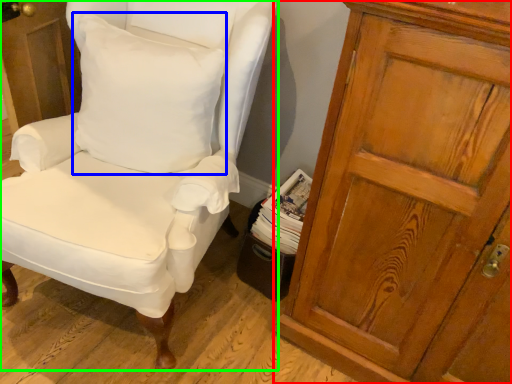
Question: Considering the real-world distances, which object is closest to cupboard (highlighted by a red box)? pillow (highlighted by a blue box) or chair (highlighted by a green box).

Choices:
 (A) pillow
 (B) chair

Answer: (B)